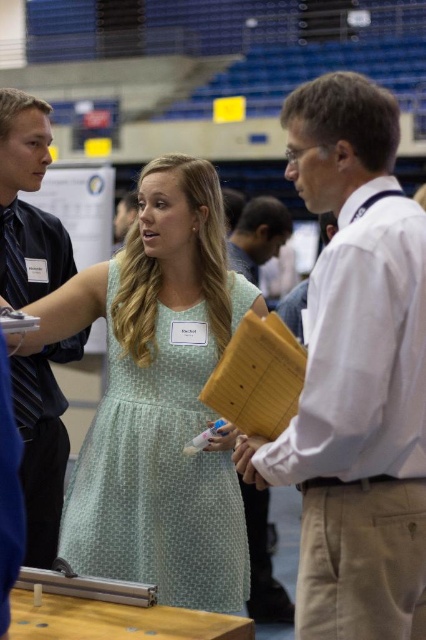
Who is taller, white shirt at center or light brown hair at center?

white shirt at center

Does point (371, 113) come closer to viewer compared to point (287, 214)?

Yes.

This screenshot has width=426, height=640. What are the coordinates of `white shirt at center` in the screenshot? It's located at (356, 374).

Does white shirt at center have a lesser height compared to dark blue shirt at left?

Yes, white shirt at center is shorter than dark blue shirt at left.

Is point (342, 572) closer to camera compared to point (20, 387)?

Yes, it is in front of point (20, 387).

Identify the location of white shirt at center. (356, 374).

Is light green polka dot dress at center to the left of dark blue shirt at left from the viewer's perspective?

No, light green polka dot dress at center is not to the left of dark blue shirt at left.

Can you confirm if light green polka dot dress at center is positioned above dark blue shirt at left?

No, light green polka dot dress at center is not above dark blue shirt at left.

The image size is (426, 640). In order to click on light green polka dot dress at center in this screenshot , I will do `click(158, 397)`.